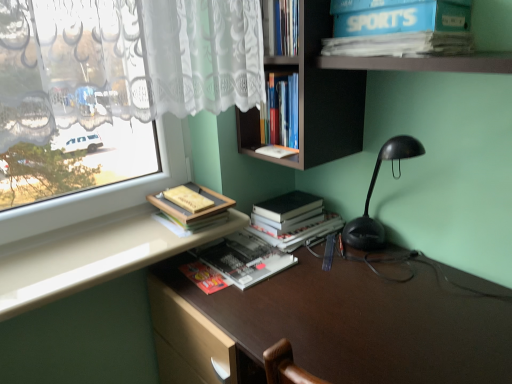
Question: From the image's perspective, is white glossy counter top at lower left located above or below hardcover books at center, the 1th book when ordered from top to bottom?

Choices:
 (A) below
 (B) above

Answer: (A)

Question: Is white glossy counter top at lower left inside or outside of hardcover books at center, marked as the 4th book in a bottom-to-top arrangement?

Choices:
 (A) outside
 (B) inside

Answer: (A)

Question: Considering the real-world distances, which object is closest to the matte yellow book at upper left, arranged as the 2th book when viewed from the top?

Choices:
 (A) hardcover book at center, marked as the fourth book in a top-to-bottom arrangement
 (B) blue cardboard box at upper right
 (C) hardcover books at center, marked as the 4th book in a bottom-to-top arrangement
 (D) brown matte desk at center
 (E) hardcover black book at center, the 2th book from the bottom

Answer: (A)

Question: Estimate the real-world distances between objects in this image. Which object is farther from the hardcover book at center, marked as the fourth book in a top-to-bottom arrangement?

Choices:
 (A) white glossy counter top at lower left
 (B) hardcover books at center, marked as the 4th book in a bottom-to-top arrangement
 (C) hardcover black book at center, positioned as the 3th book in top-to-bottom order
 (D) blue cardboard box at upper right
 (E) matte yellow book at upper left, the third book in the bottom-to-top sequence

Answer: (D)